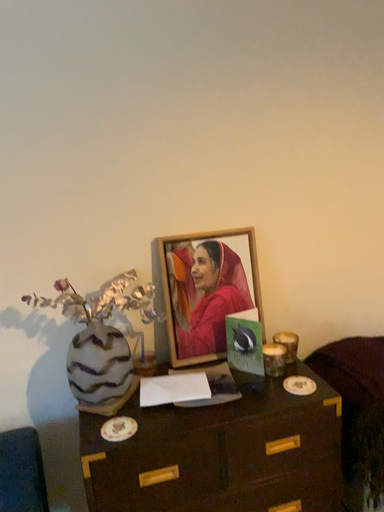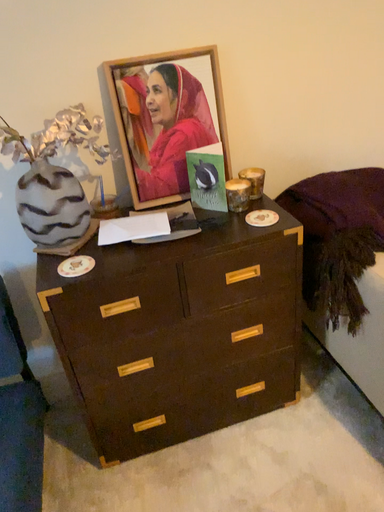
Question: How did the camera likely rotate when shooting the video?

Choices:
 (A) rotated downward
 (B) rotated upward

Answer: (A)